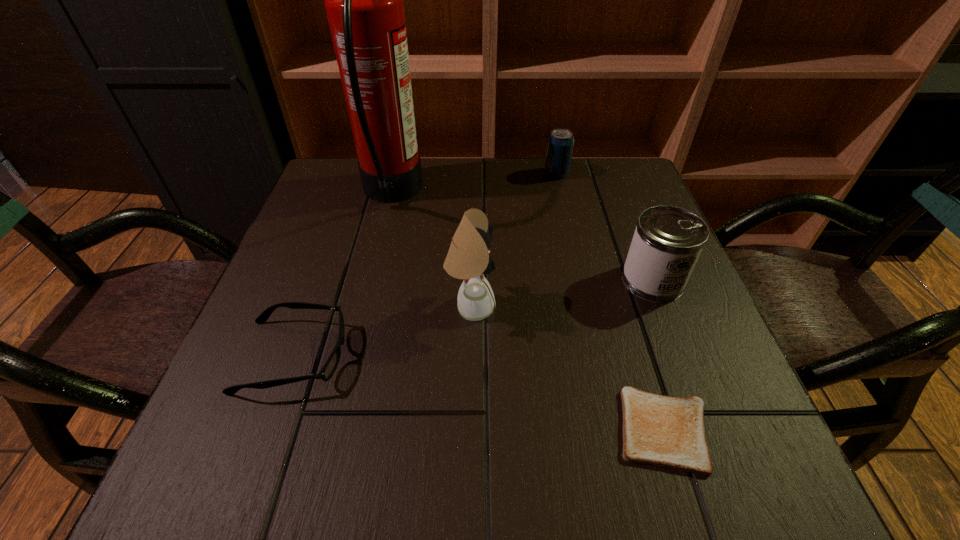
Identify the location of object that is at the far left corner. This screenshot has width=960, height=540. (363, 0).

In order to click on object that is at the near right corner in this screenshot , I will do `click(662, 431)`.

Locate an element on the screen. vacant space at the far edge is located at coordinates (498, 164).

Image resolution: width=960 pixels, height=540 pixels. Identify the location of blank space at the near edge of the desktop. (516, 481).

Image resolution: width=960 pixels, height=540 pixels. In the image, there is a desktop. Find the location of `vacant space at the left edge`. vacant space at the left edge is located at coordinates (243, 430).

Where is `vacant space at the right edge`? vacant space at the right edge is located at coordinates (738, 390).

Where is `empty location between the fourth object from right to left and the fourth shortest object`? The image size is (960, 540). empty location between the fourth object from right to left and the fourth shortest object is located at coordinates (562, 294).

The height and width of the screenshot is (540, 960). Find the location of `free space between the shortest object and the tallest object`. free space between the shortest object and the tallest object is located at coordinates (528, 312).

This screenshot has width=960, height=540. Find the location of `free space between the shortest object and the pop soda`. free space between the shortest object and the pop soda is located at coordinates (611, 301).

Locate an element on the screen. This screenshot has width=960, height=540. free spot between the second shortest object and the fourth tallest object is located at coordinates (425, 265).